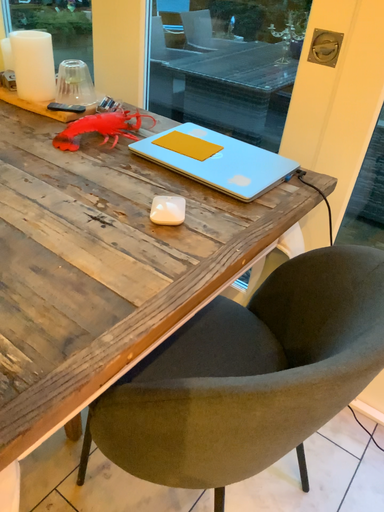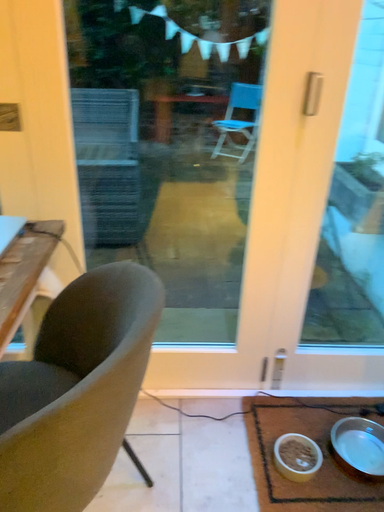
Question: How did the camera likely rotate when shooting the video?

Choices:
 (A) rotated upward
 (B) rotated downward

Answer: (A)